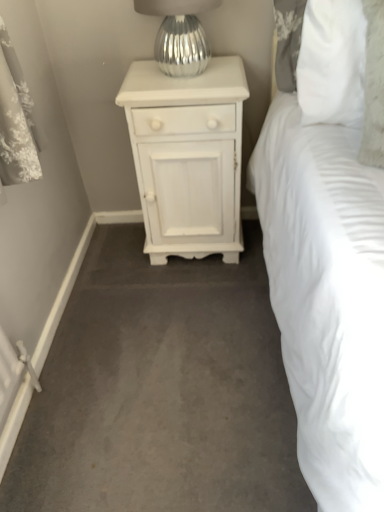
Locate an element on the screen. Image resolution: width=384 pixels, height=512 pixels. empty space that is ontop of smooth gray carpet at center (from a real-world perspective) is located at coordinates click(x=165, y=340).